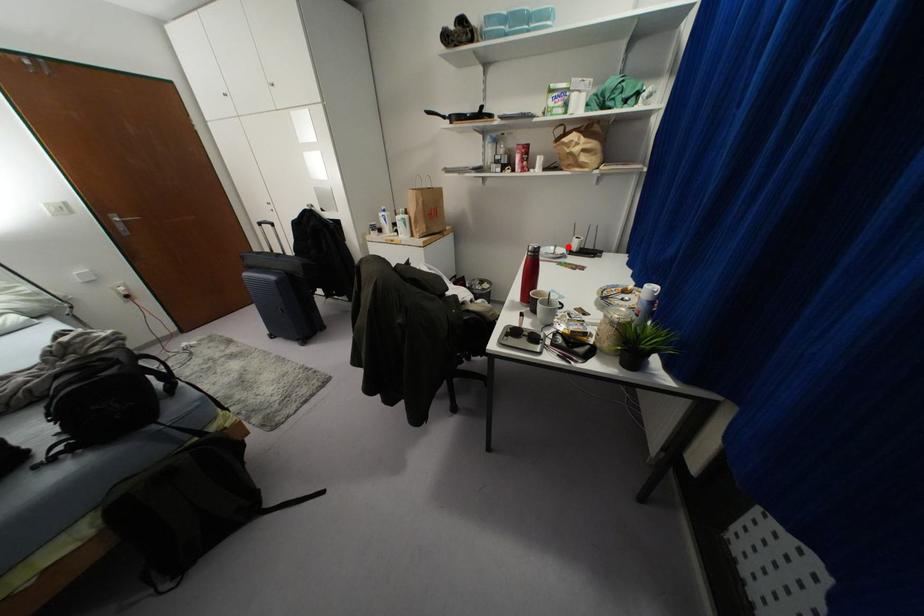
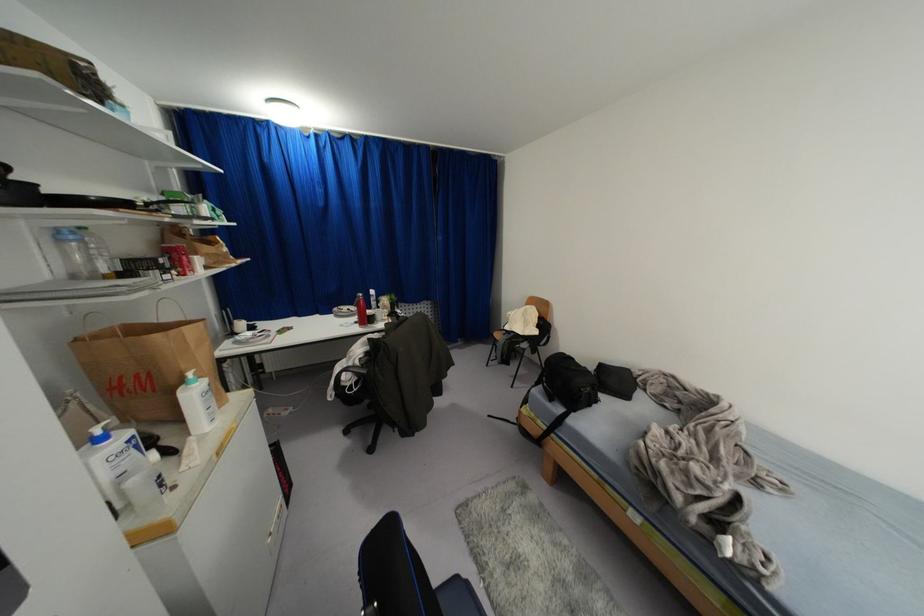
In the second image, find the point that corresponds to the highlighted location in the first image.

(234, 333)